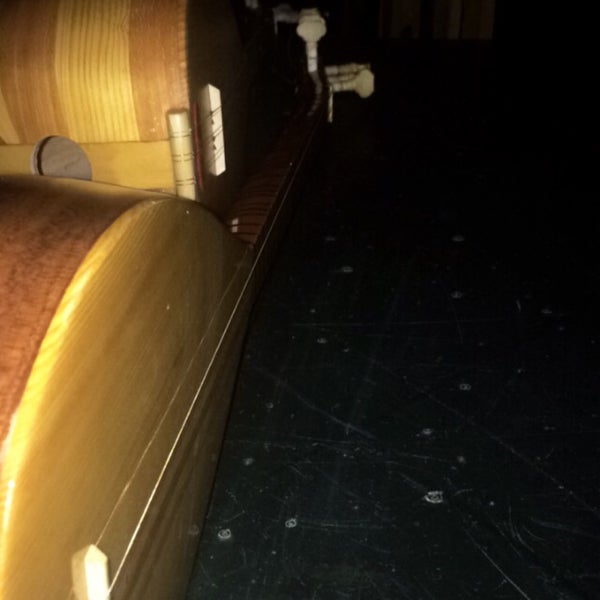
At what (x,y) coordinates should I click in order to perform the action: click on table. Please return your answer as a coordinate pair (x, y). The image size is (600, 600). Looking at the image, I should click on (69, 414).